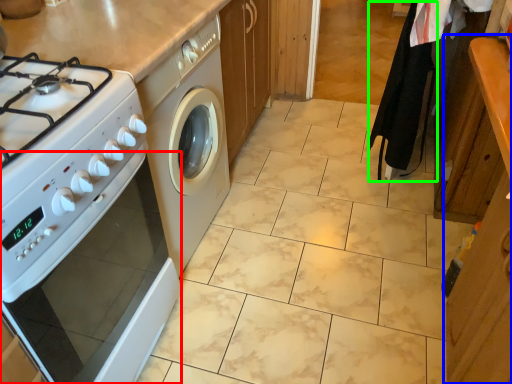
Question: Estimate the real-world distances between objects in this image. Which object is farther from oven (highlighted by a red box), cabinetry (highlighted by a blue box) or robe (highlighted by a green box)?

Choices:
 (A) cabinetry
 (B) robe

Answer: (B)